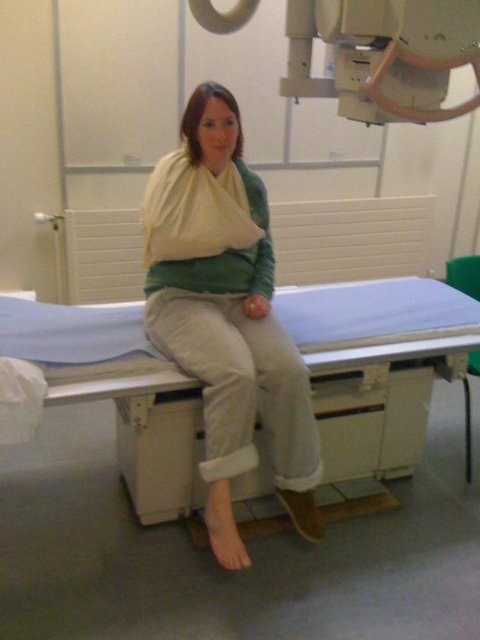
Can you confirm if blue fabric hospital bed at center is bigger than matte white arm sling at center?

Yes, blue fabric hospital bed at center is bigger than matte white arm sling at center.

This screenshot has height=640, width=480. What do you see at coordinates (376, 368) in the screenshot?
I see `blue fabric hospital bed at center` at bounding box center [376, 368].

Which is behind, point (349, 284) or point (215, 342)?

The point (349, 284) is more distant.

This screenshot has width=480, height=640. Identify the location of blue fabric hospital bed at center. click(376, 368).